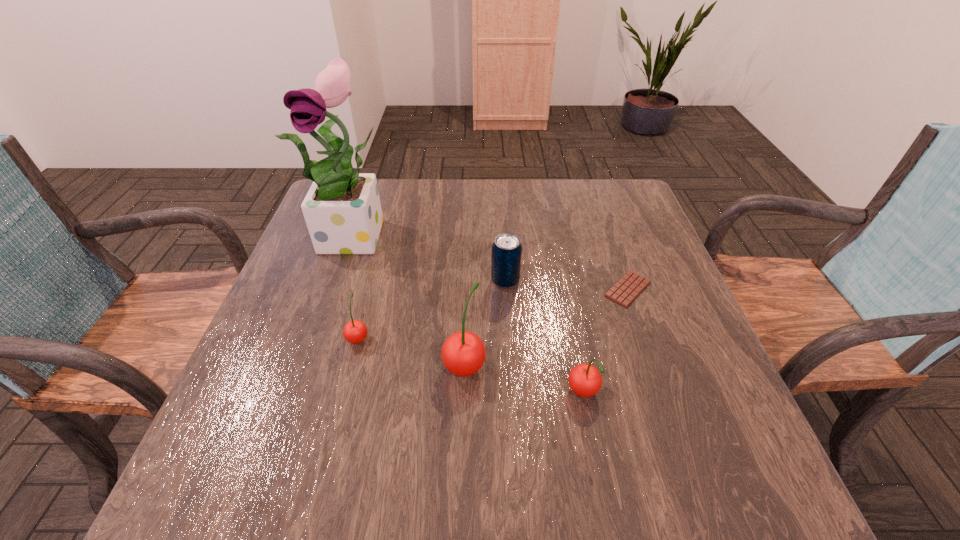
In order to click on vacant space in between the tallest cherry and the fourth object from left to right in this screenshot , I will do `click(485, 322)`.

In order to click on vacant space that is in between the rightmost object and the second object from right to left in this screenshot , I will do `click(606, 342)`.

In order to click on vacant area that lies between the fourth object from left to right and the second tallest cherry in this screenshot , I will do `click(544, 338)`.

Find the location of a particular element. The height and width of the screenshot is (540, 960). vacant area that lies between the soda can and the flower arrangement is located at coordinates (432, 258).

Identify the location of vacant space that's between the fourth object from right to left and the fourth object from left to right. The width and height of the screenshot is (960, 540). click(485, 322).

Identify the location of vacant area that lies between the second object from right to left and the tallest object. Image resolution: width=960 pixels, height=540 pixels. (470, 315).

The width and height of the screenshot is (960, 540). I want to click on free point between the second tallest object and the leftmost cherry, so point(411,351).

This screenshot has width=960, height=540. Identify the location of object that is the closest to the farthest object. (355, 331).

Locate an element on the screen. This screenshot has width=960, height=540. object that is the second closest to the second object from right to left is located at coordinates (624, 292).

Find the location of a particular element. cherry that is the closest to the soda can is located at coordinates (463, 353).